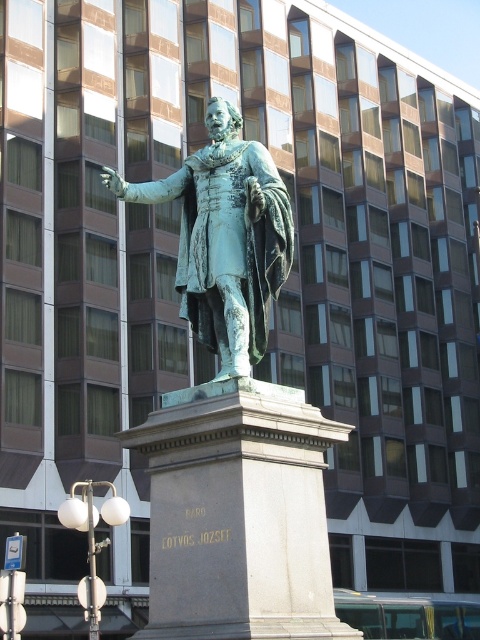
Based on the photo, you are an art student analyzing the image. You notice two statues in the scene. Which one is closer to you, the green patina statue at center or the green patina bronze statue at center?

The green patina statue at center is closer to you because it is in front of the green patina bronze statue at center.

You are a photographer standing in front of the green patina statue at center. You want to take a photo that includes the statue and the nearby park bench. The park bench is 15 meters away from you. Can you fit both the statue and the bench in the same frame without moving your position?

The green patina statue at center is 14.91 meters from the camera, while the park bench is 15 meters away. Since the statue is closer to you than the bench, both objects will be within the same frame as long as your camera lens has a wide enough angle to capture both distances simultaneously.

You are a city planner reviewing a proposal to install a new bench. The bench will be placed at point (233,419). Where will the bench be located?

The bench will be placed at the green patina statue at center, as point (233,419) marks that location.